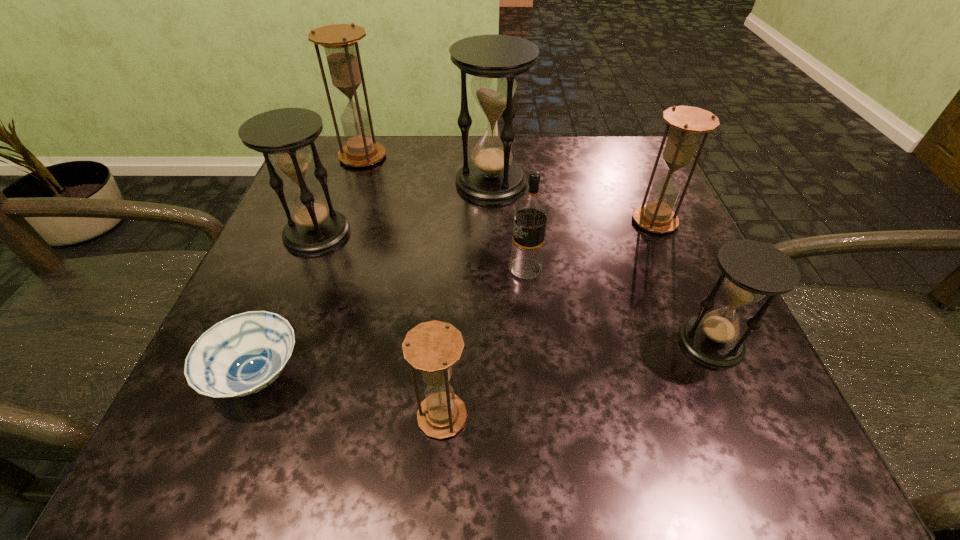
You are a GUI agent. You are given a task and a screenshot of the screen. Output one action in this format:
    pyautogui.click(x=<x>, y=<y>)
    Task: Click on the empty location between the second nearest black hourglass and the fourth nearest object
    
    Given the screenshot: What is the action you would take?
    pyautogui.click(x=421, y=251)

Identify the location of free area in between the rightmost black hourglass and the blue soup bowl. The width and height of the screenshot is (960, 540). (484, 359).

Find the location of a particular element. vacant region between the second nearest black hourglass and the nearest black hourglass is located at coordinates (514, 288).

Where is `vacant area that lies between the vodka and the smallest brown hourglass`? This screenshot has height=540, width=960. vacant area that lies between the vodka and the smallest brown hourglass is located at coordinates (484, 342).

Locate an element on the screen. free space between the biggest brown hourglass and the second nearest black hourglass is located at coordinates (340, 195).

Where is `free space between the second nearest black hourglass and the smallest black hourglass`? This screenshot has height=540, width=960. free space between the second nearest black hourglass and the smallest black hourglass is located at coordinates (514, 288).

Locate which object is the closest to the fourth nearest object. Please provide its 2D coordinates. Your answer should be formatted as a tuple, i.e. [(x, y)], where the tuple contains the x and y coordinates of a point satisfying the conditions above.

[(491, 177)]

Locate an element on the screen. The image size is (960, 540). object that is the second closest one to the fourth nearest object is located at coordinates (687, 123).

Find the location of a particular element. This screenshot has height=540, width=960. hourglass that is the closest to the second farthest brown hourglass is located at coordinates (491, 177).

At what (x,y) coordinates should I click in order to perform the action: click on the closest hourglass relative to the second nearest black hourglass. Please return your answer as a coordinate pair (x, y). The height and width of the screenshot is (540, 960). Looking at the image, I should click on (340, 43).